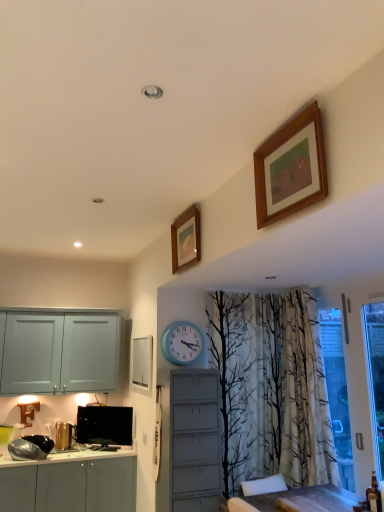
Question: Looking at their shapes, would you say blue plastic clock at center is wider or thinner than wooden-framed painting at upper right, the third picture frame in the bottom-to-top sequence?

Choices:
 (A) thin
 (B) wide

Answer: (B)

Question: Is point (167, 336) closer or farther from the camera than point (276, 170)?

Choices:
 (A) farther
 (B) closer

Answer: (A)

Question: Estimate the real-world distances between objects in this image. Which object is closer to the blue plastic clock at center?

Choices:
 (A) wooden picture frame at upper center, positioned as the second picture frame in front-to-back order
 (B) wooden-framed painting at upper right, the 3th picture frame from the back
 (C) white matte picture frame at center, positioned as the 3th picture frame in top-to-bottom order
 (D) black glossy television at lower left

Answer: (C)

Question: Which of these objects is positioned closest to the black glossy television at lower left?

Choices:
 (A) wooden picture frame at upper center, which appears as the second picture frame when viewed from the right
 (B) blue plastic clock at center
 (C) white matte picture frame at center, positioned as the third picture frame in right-to-left order
 (D) wooden-framed painting at upper right, which ranks as the 1th picture frame in top-to-bottom order

Answer: (C)